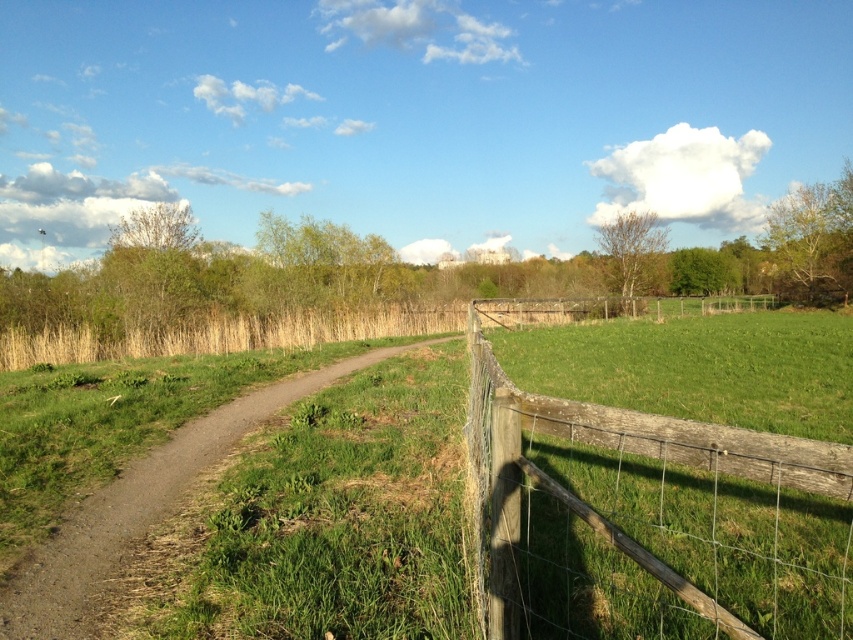
You are standing at the camera position looking at the rural landscape. There is a point marked at coordinates point (509, 531). If you want to place a 10 feet long pole from the camera to that point, will the pole reach the point?

The distance from the camera to point (509, 531) is 9.68 feet, so the 10 feet long pole will reach the point with some extra length remaining.

You are a gardener planning to mow the grass between the wooden wire fence at right and the dirt path at center. Which one has a greater width to allow the mower to pass through more easily?

The wooden wire fence at right has a greater width than the dirt path at center, so the mower can pass through more easily between the wooden wire fence at right and the dirt path at center.